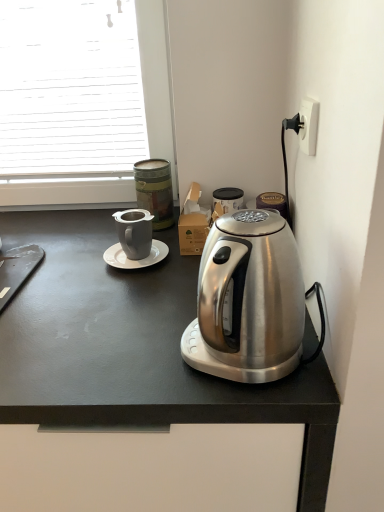
Question: Considering the relative sizes of satin silver kettle at right and satin silver kettle at center in the image provided, is satin silver kettle at right bigger than satin silver kettle at center?

Choices:
 (A) yes
 (B) no

Answer: (B)

Question: Is satin silver kettle at right to the left of satin silver kettle at center from the viewer's perspective?

Choices:
 (A) no
 (B) yes

Answer: (A)

Question: Is satin silver kettle at right closer to camera compared to satin silver kettle at center?

Choices:
 (A) yes
 (B) no

Answer: (A)

Question: Is satin silver kettle at right taller than satin silver kettle at center?

Choices:
 (A) no
 (B) yes

Answer: (A)

Question: From the image's perspective, would you say satin silver kettle at right is positioned over satin silver kettle at center?

Choices:
 (A) no
 (B) yes

Answer: (B)

Question: Is satin silver kettle at right not inside satin silver kettle at center?

Choices:
 (A) no
 (B) yes

Answer: (B)

Question: Does white glossy saucer at center have a lesser width compared to matte gray mug at upper center?

Choices:
 (A) yes
 (B) no

Answer: (A)

Question: Is white glossy saucer at center wider than matte gray mug at upper center?

Choices:
 (A) no
 (B) yes

Answer: (A)

Question: From the image's perspective, is white glossy saucer at center above matte gray mug at upper center?

Choices:
 (A) yes
 (B) no

Answer: (B)

Question: Considering the relative positions of white glossy saucer at center and matte gray mug at upper center in the image provided, is white glossy saucer at center to the right of matte gray mug at upper center from the viewer's perspective?

Choices:
 (A) yes
 (B) no

Answer: (B)

Question: Is matte gray mug at upper center a part of white glossy saucer at center?

Choices:
 (A) yes
 (B) no

Answer: (B)

Question: Are white glossy saucer at center and matte gray mug at upper center beside each other?

Choices:
 (A) no
 (B) yes

Answer: (A)

Question: Does white plastic power outlet at upper right have a lesser width compared to satin silver kettle at right?

Choices:
 (A) no
 (B) yes

Answer: (B)